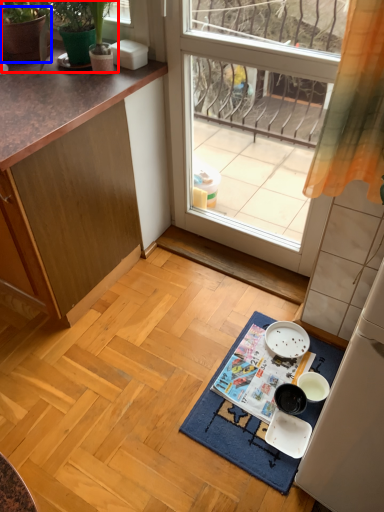
Question: Which object is closer to the camera taking this photo, plant (highlighted by a red box) or flowerpot (highlighted by a blue box)?

Choices:
 (A) plant
 (B) flowerpot

Answer: (A)